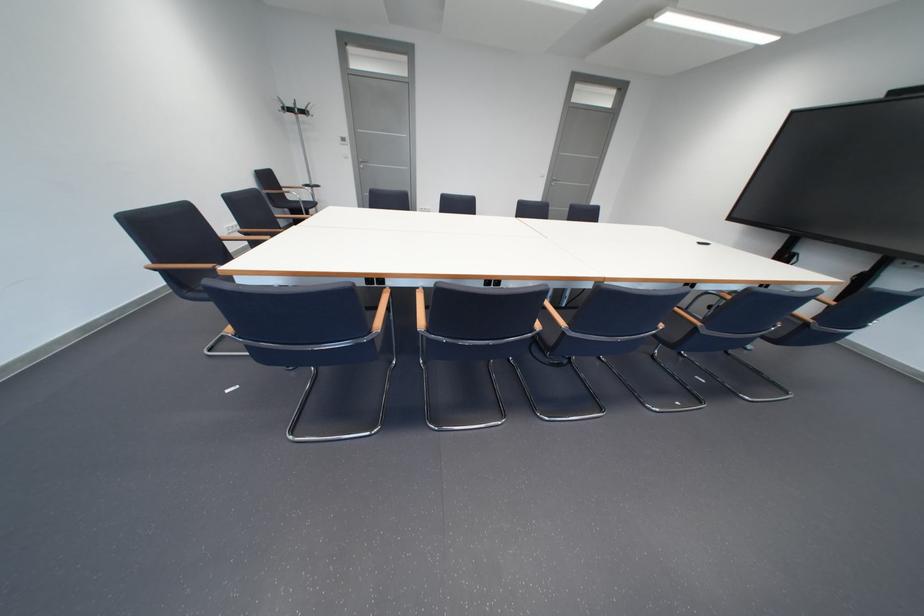
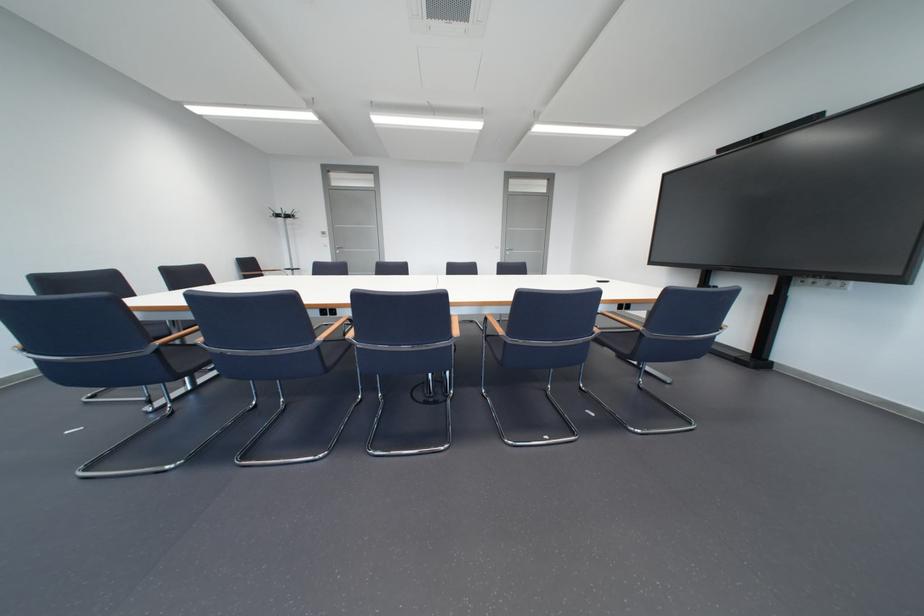
Question: What movement of the cameraman would produce the second image?

Choices:
 (A) Left
 (B) Right
 (C) Forward
 (D) Backward

Answer: (B)